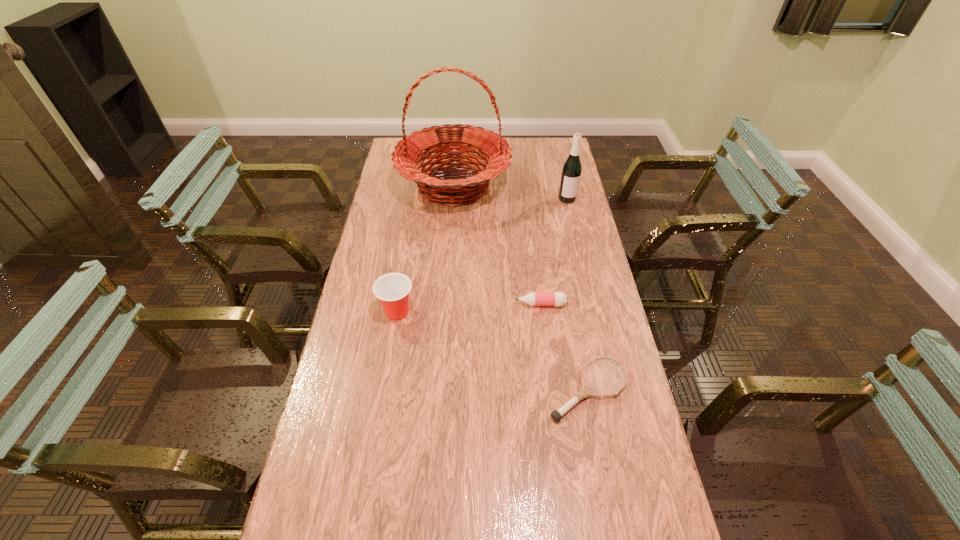
Where is `free space at the left edge of the desktop`? free space at the left edge of the desktop is located at coordinates (385, 194).

What are the coordinates of `free location at the right edge of the desktop` in the screenshot? It's located at (586, 274).

Locate an element on the screen. vacant region at the far right corner of the desktop is located at coordinates (540, 164).

At what (x,y) coordinates should I click in order to perform the action: click on vacant area between the cup and the tennis racket. Please return your answer as a coordinate pair (x, y). Looking at the image, I should click on (493, 351).

Where is `vacant space that is in between the basket and the fourth shortest object`? Image resolution: width=960 pixels, height=540 pixels. vacant space that is in between the basket and the fourth shortest object is located at coordinates (511, 192).

You are a GUI agent. You are given a task and a screenshot of the screen. Output one action in this format:
    pyautogui.click(x=<x>, y=<y>)
    Task: Click on the free space between the third tallest object and the tennis racket
    The image size is (960, 540).
    Given the screenshot: What is the action you would take?
    pyautogui.click(x=493, y=351)

Where is `free area in between the bottle and the tallest object`? The width and height of the screenshot is (960, 540). free area in between the bottle and the tallest object is located at coordinates (497, 245).

Locate an element on the screen. The image size is (960, 540). free spot between the tennis racket and the cup is located at coordinates (493, 351).

This screenshot has height=540, width=960. I want to click on vacant region between the tennis racket and the cup, so click(x=493, y=351).

The width and height of the screenshot is (960, 540). I want to click on blank region between the bottle and the nearest object, so click(564, 347).